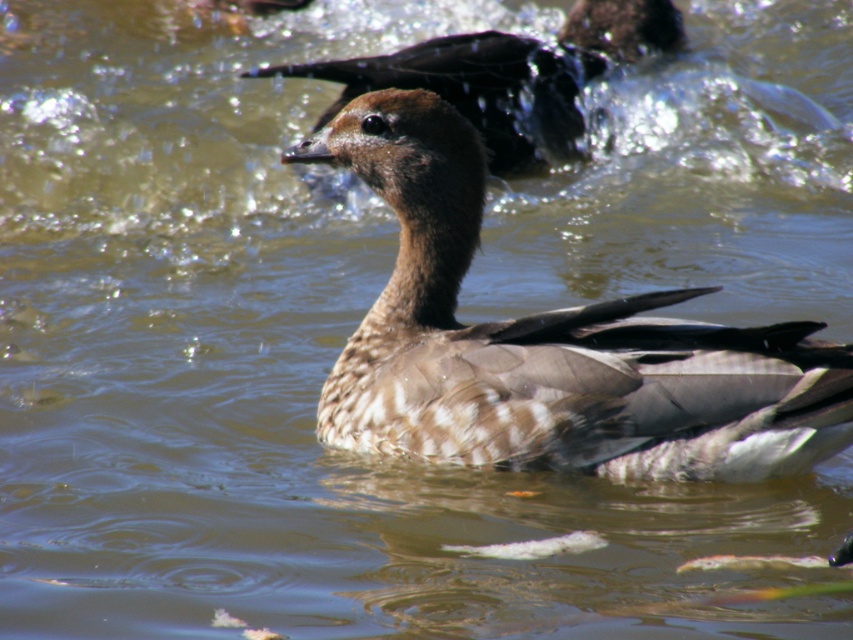
Is brown feathered duck at center wider than brown feathered goose at upper center?

No, brown feathered duck at center is not wider than brown feathered goose at upper center.

Who is lower down, brown feathered duck at center or brown feathered goose at upper center?

brown feathered duck at center is lower down.

Who is more forward, (540, 380) or (480, 76)?

Point (540, 380) is in front.

Locate an element on the screen. brown feathered duck at center is located at coordinates (550, 344).